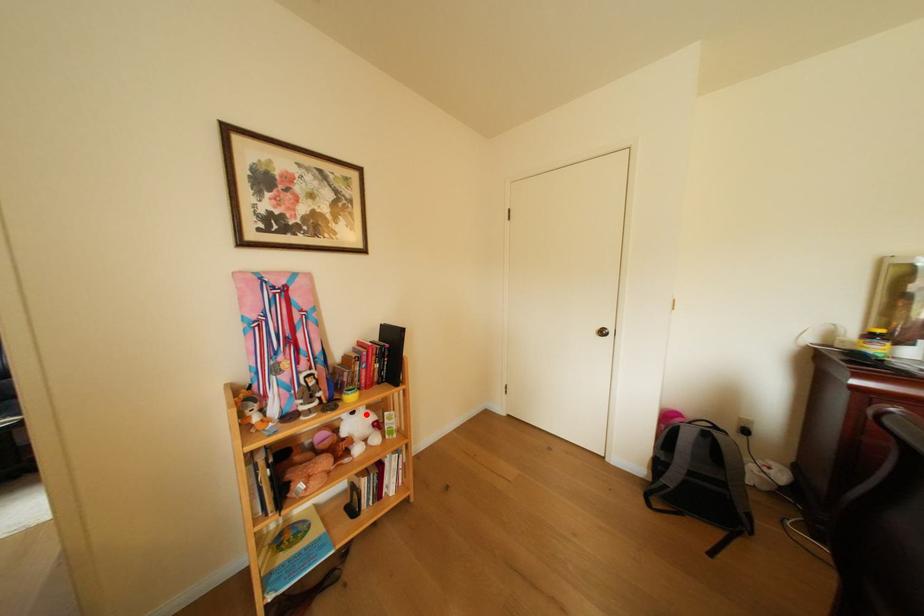
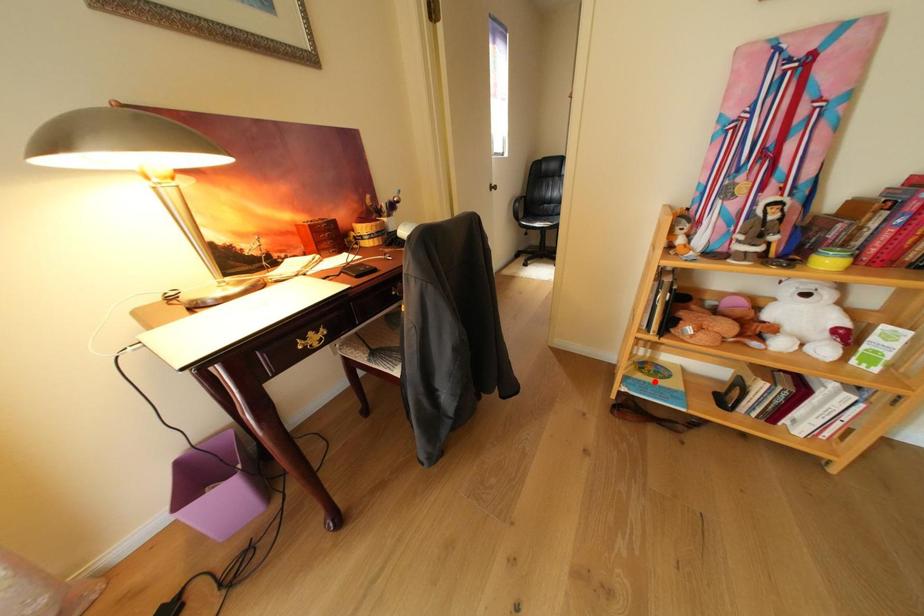
I am providing you with two images of the same scene from different viewpoints. A red point is marked on the first image and another point is marked on the second image. Is the marked point in image1 the same physical position as the marked point in image2?

No